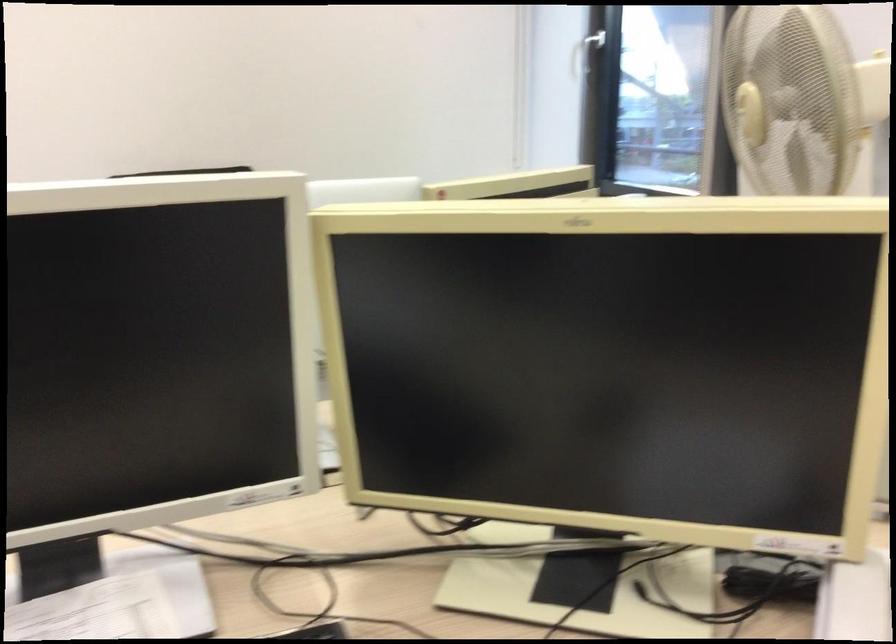
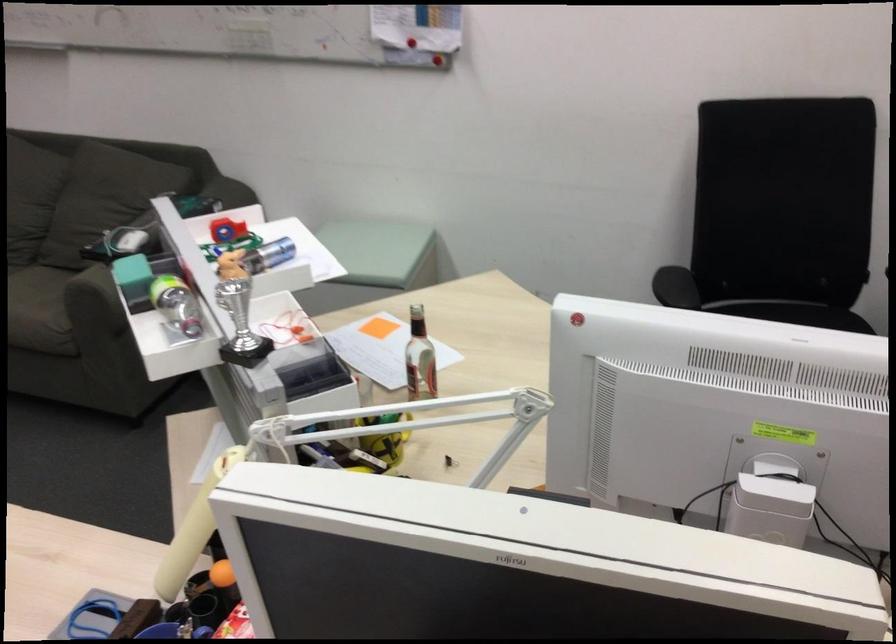
Based on the continuous images, in which direction is the camera rotating?

The camera's rotation is toward left-down.